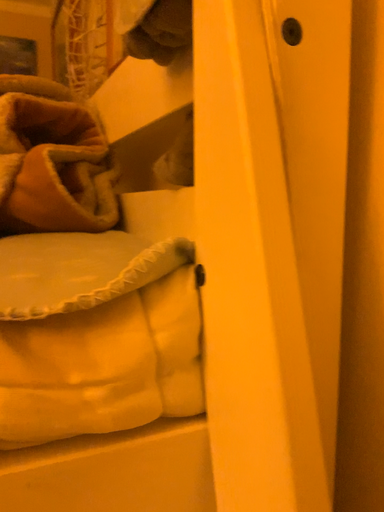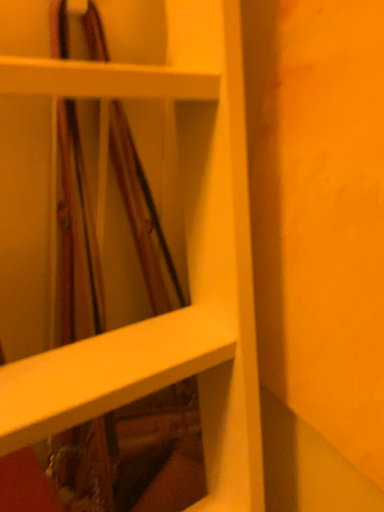
Question: Which way did the camera rotate in the video?

Choices:
 (A) rotated upward
 (B) rotated downward

Answer: (B)